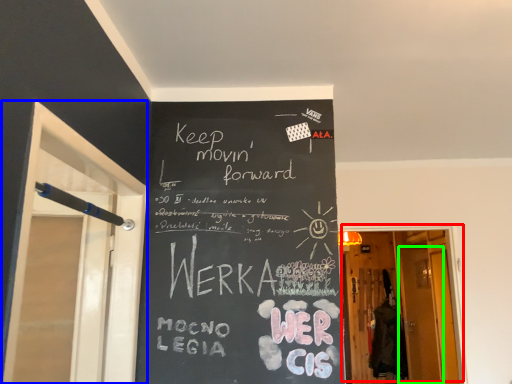
Question: Based on their relative distances, which object is farther from door (highlighted by a red box)? Choose from screen door (highlighted by a blue box) and screen door (highlighted by a green box).

Choices:
 (A) screen door
 (B) screen door

Answer: (A)